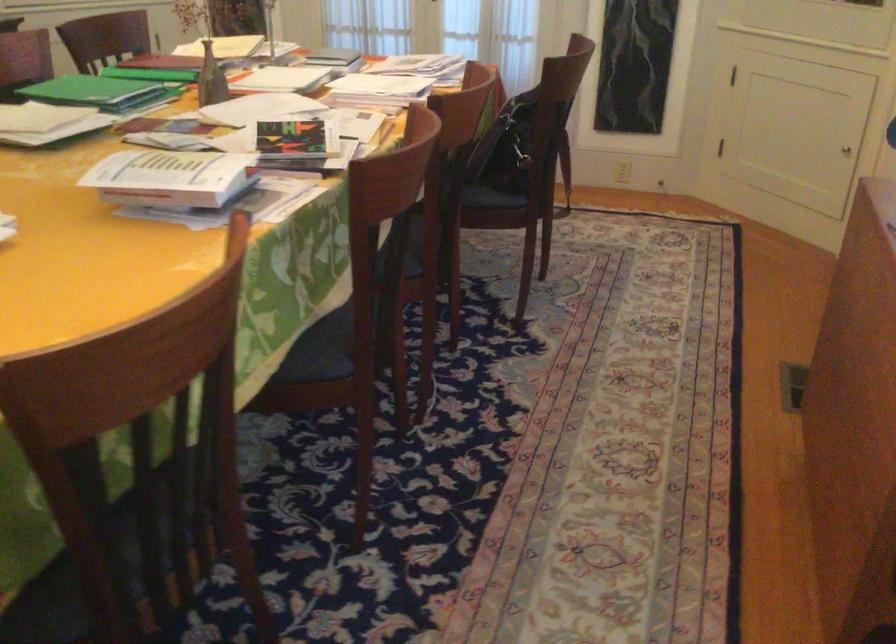
Where would you lift the small brown vase? Please return your answer as a coordinate pair (x, y).

(211, 79)